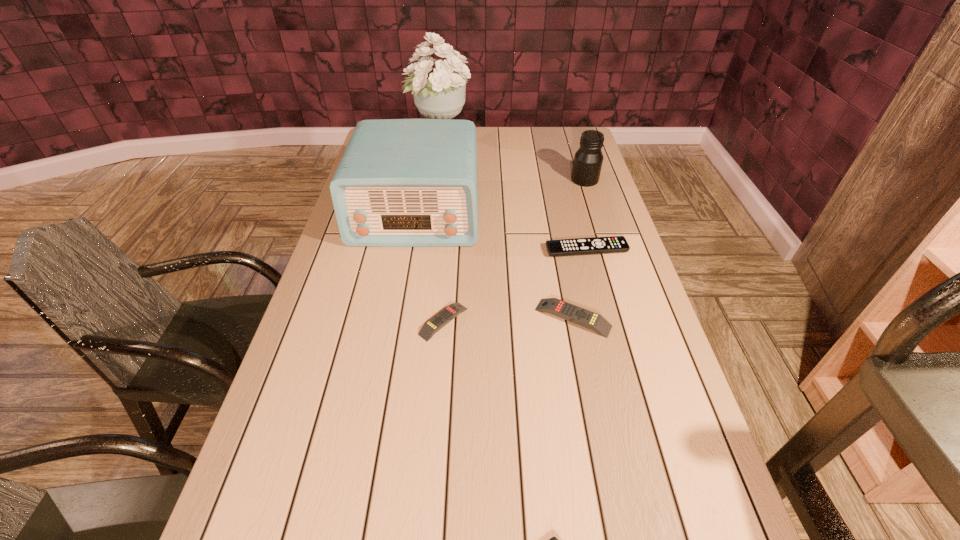
The image size is (960, 540). Find the location of `free space located on the front panel of the radio receiver`. free space located on the front panel of the radio receiver is located at coordinates (391, 359).

Where is `vacant area located on the left of the fifth shortest object`? vacant area located on the left of the fifth shortest object is located at coordinates (557, 180).

Locate an element on the screen. vacant region located 0.220m on the left of the bigger yellow remote control is located at coordinates (448, 318).

At what (x,y) coordinates should I click in order to perform the action: click on vacant space situated on the front of the farthest remote control. Please return your answer as a coordinate pair (x, y). This screenshot has width=960, height=540. Looking at the image, I should click on (610, 335).

Locate an element on the screen. free spot located on the left of the smaller yellow remote control is located at coordinates (348, 321).

Where is `object located at the far edge`? The height and width of the screenshot is (540, 960). object located at the far edge is located at coordinates (440, 94).

At what (x,y) coordinates should I click in order to perform the action: click on bouquet that is at the left edge. Please return your answer as a coordinate pair (x, y). Looking at the image, I should click on (440, 94).

Image resolution: width=960 pixels, height=540 pixels. In order to click on radio receiver at the left edge in this screenshot , I will do `click(401, 182)`.

Locate an element on the screen. jar that is at the right edge is located at coordinates (588, 159).

You are a GUI agent. You are given a task and a screenshot of the screen. Output one action in this format:
    pyautogui.click(x=<x>, y=<y>)
    Task: Click on the object situated at the far left corner
    The width and height of the screenshot is (960, 540).
    Given the screenshot: What is the action you would take?
    pyautogui.click(x=440, y=94)